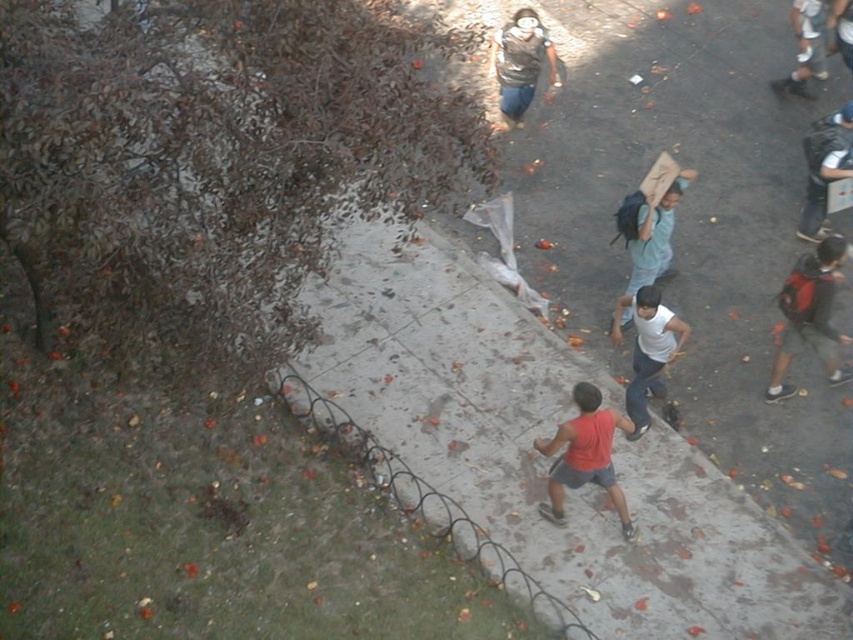
You are standing on a balcony overlooking a park. You see a red matte tank top at center and a dark blue backpack at right. Which object is nearer to you?

The red matte tank top at center is closer to the viewer than the dark blue backpack at right.

You are standing on a balcony overlooking the park. You notice a red backpack at right and light blue jeans at upper right. Which object takes up more space in the scene?

The red backpack at right is bigger than light blue jeans at upper right, so it takes up more space in the scene.